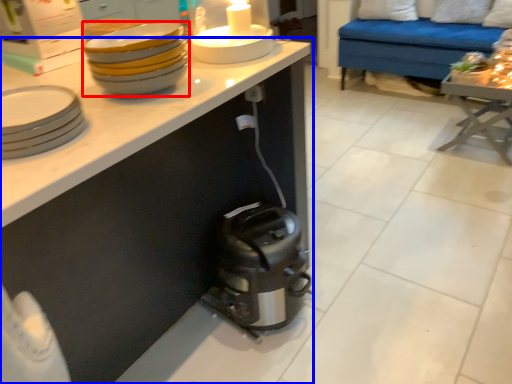
Question: Which of the following is the farthest to the observer, tableware (highlighted by a red box) or cabinetry (highlighted by a blue box)?

Choices:
 (A) tableware
 (B) cabinetry

Answer: (A)